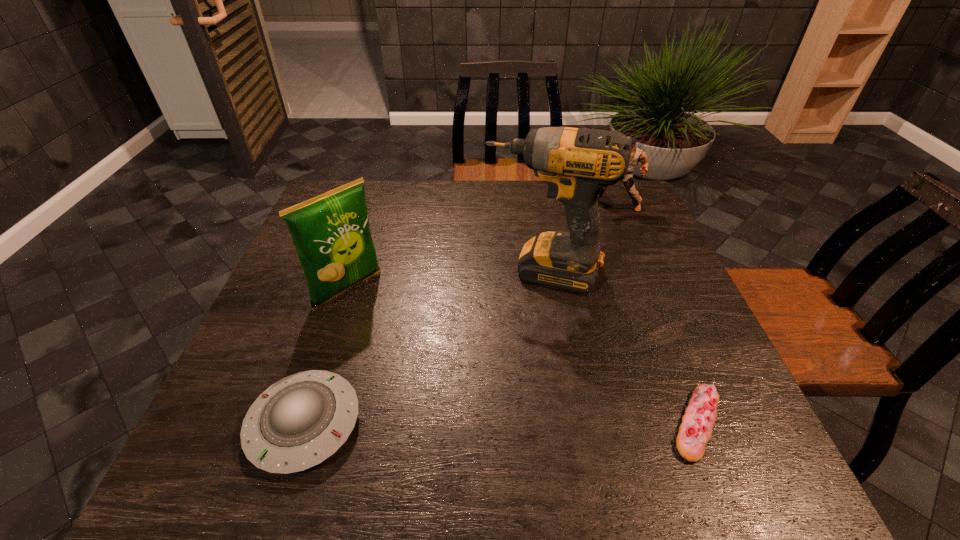
Where is `free region located 0.220m on the front-facing side of the crisp (potato chip)`? This screenshot has width=960, height=540. free region located 0.220m on the front-facing side of the crisp (potato chip) is located at coordinates (423, 356).

Where is `vacant area located on the front-facing side of the crisp (potato chip)`? vacant area located on the front-facing side of the crisp (potato chip) is located at coordinates (380, 318).

Identify the location of vacant space positioned 0.370m with the drill bit of the tallest object facing forward. (486, 427).

Where is `free location located 0.150m with the drill bit of the tallest object facing forward`? free location located 0.150m with the drill bit of the tallest object facing forward is located at coordinates (514, 340).

Find the location of a particular element. This screenshot has width=960, height=540. free space located with the drill bit of the tallest object facing forward is located at coordinates (501, 380).

Identify the location of blank space located 0.090m on the front-facing side of the puncher. The height and width of the screenshot is (540, 960). pos(592,228).

This screenshot has height=540, width=960. I want to click on vacant space located 0.080m on the front-facing side of the puncher, so click(x=593, y=226).

The height and width of the screenshot is (540, 960). In order to click on free space located on the front-facing side of the puncher in this screenshot , I will do `click(594, 225)`.

Identify the location of object present at the far edge. (637, 155).

Where is `saucer at the near edge`? saucer at the near edge is located at coordinates (300, 421).